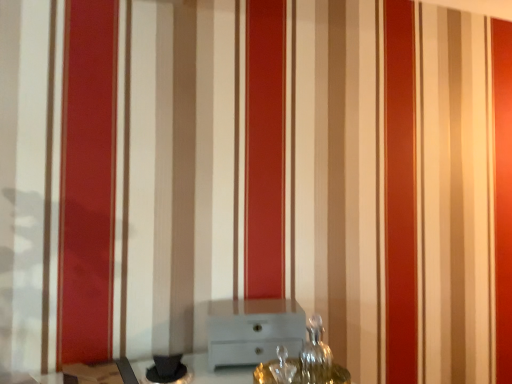
Measure the distance between white glossy file cabinet at center and camera.

white glossy file cabinet at center and camera are 1.03 meters apart from each other.

Locate an element on the screen. The height and width of the screenshot is (384, 512). white glossy file cabinet at center is located at coordinates (253, 330).

In order to face white glossy file cabinet at center, should I rotate leftwards or rightwards?

It's best to rotate right around 0.112 degrees.

This screenshot has height=384, width=512. What do you see at coordinates (253, 330) in the screenshot?
I see `white glossy file cabinet at center` at bounding box center [253, 330].

Locate an element on the screen. white glossy file cabinet at center is located at coordinates (253, 330).